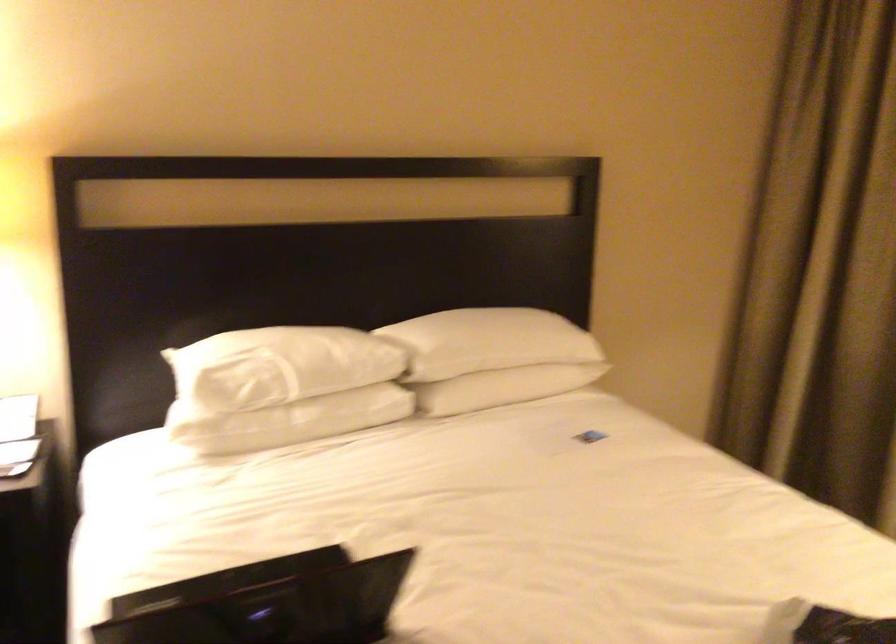
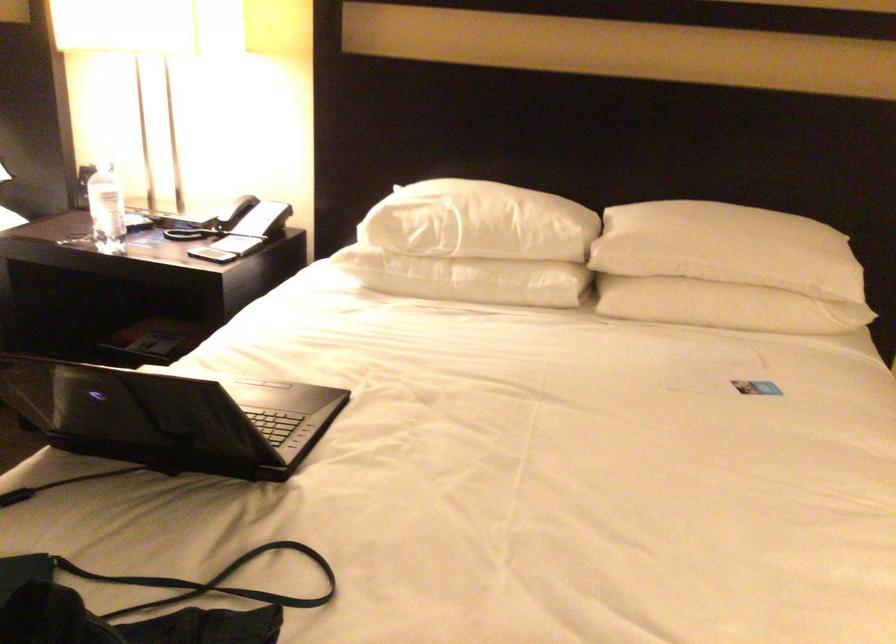
In the second image, find the point that corresponds to the point at 591,440 in the first image.

(755, 386)